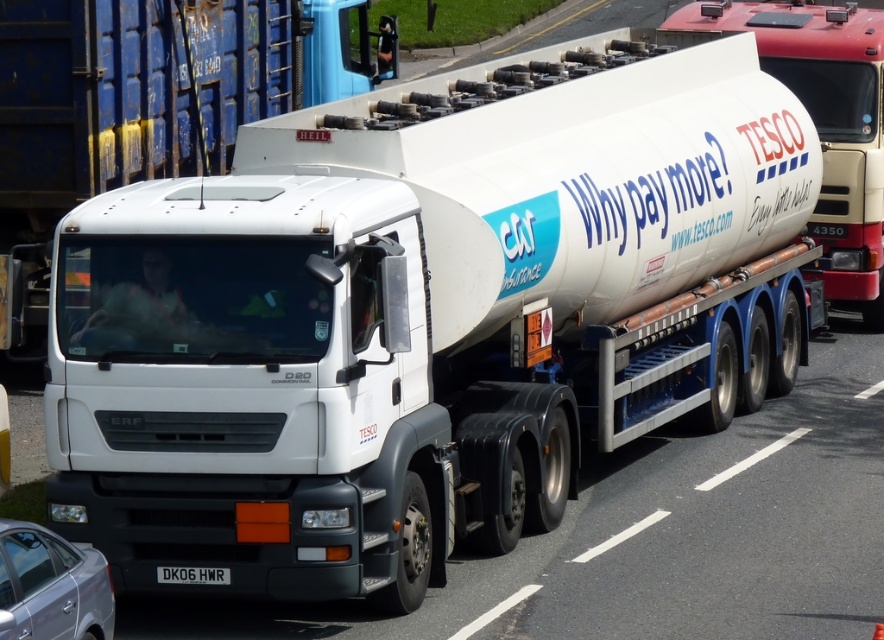
Question: Among these points, which one is nearest to the camera?

Choices:
 (A) (179, 573)
 (B) (2, 68)
 (C) (692, 19)

Answer: (A)

Question: Which object appears closest to the camera in this image?

Choices:
 (A) black metal/license plate at lower center
 (B) silver metallic sedan at lower left

Answer: (B)

Question: Which object is farther from the camera taking this photo?

Choices:
 (A) white matte truck at center
 (B) white glossy tanker at center
 (C) silver metallic sedan at lower left
 (D) black metal/license plate at lower center

Answer: (A)

Question: Is white matte truck at center smaller than silver metallic sedan at lower left?

Choices:
 (A) yes
 (B) no

Answer: (B)

Question: Does white matte truck at center appear on the right side of black metal/license plate at lower center?

Choices:
 (A) no
 (B) yes

Answer: (B)

Question: Does white matte truck at center appear under white glossy tanker at center?

Choices:
 (A) yes
 (B) no

Answer: (B)